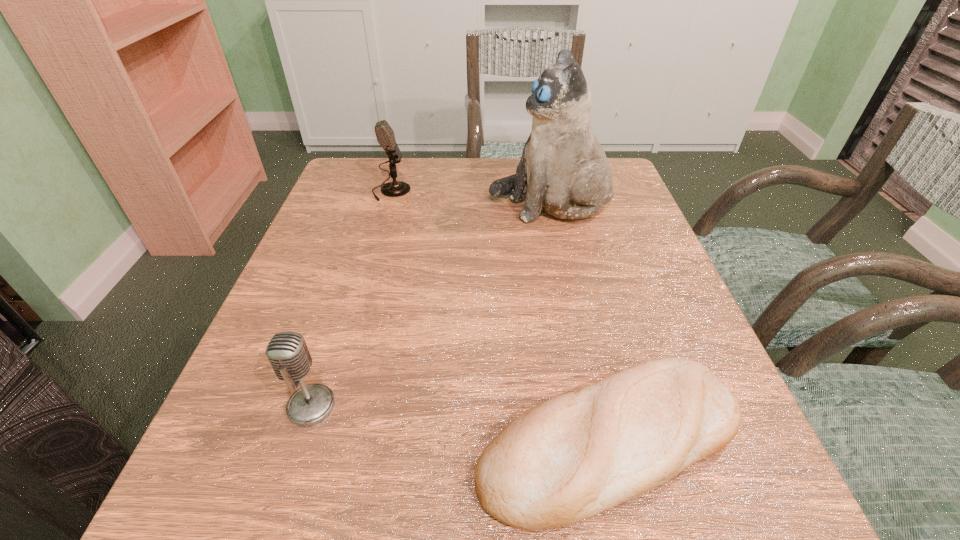
Identify the location of free space that satisfies the following two spatial constraints: 1. on the front-facing side of the farther microphone; 2. on the front side of the nearer microphone. The height and width of the screenshot is (540, 960). (330, 406).

Identify the location of vacant space that satisfies the following two spatial constraints: 1. on the front-facing side of the farther microphone; 2. on the left side of the bread. (320, 441).